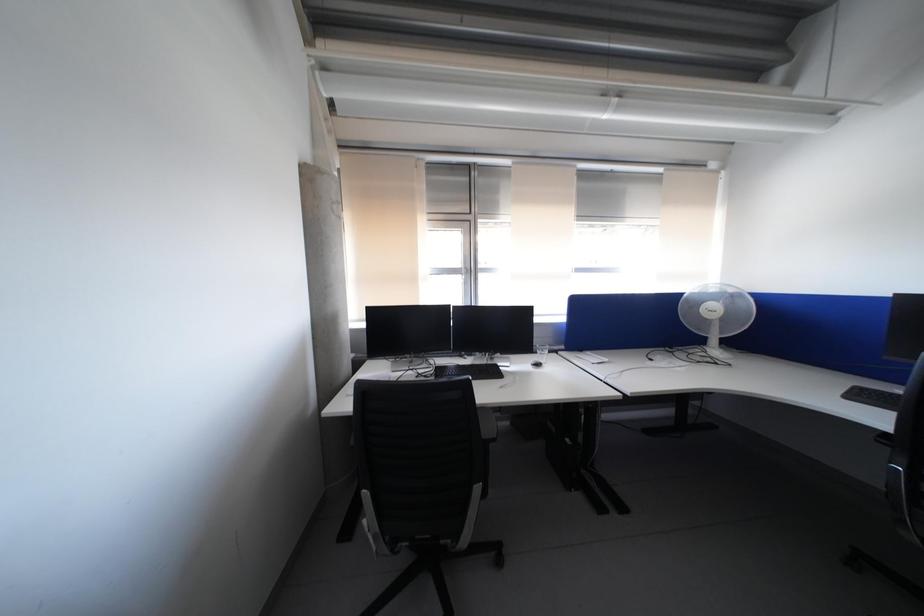
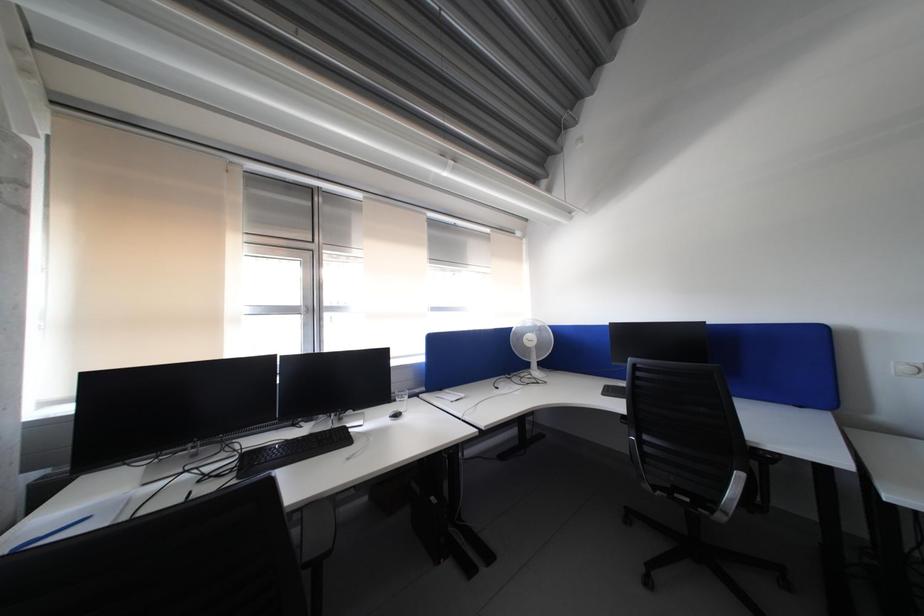
Question: The camera is either moving clockwise (left) or counter-clockwise (right) around the object. The first image is from the beginning of the video and the second image is from the end. Is the camera moving left or right when shooting the video?

Choices:
 (A) Left
 (B) Right

Answer: (A)